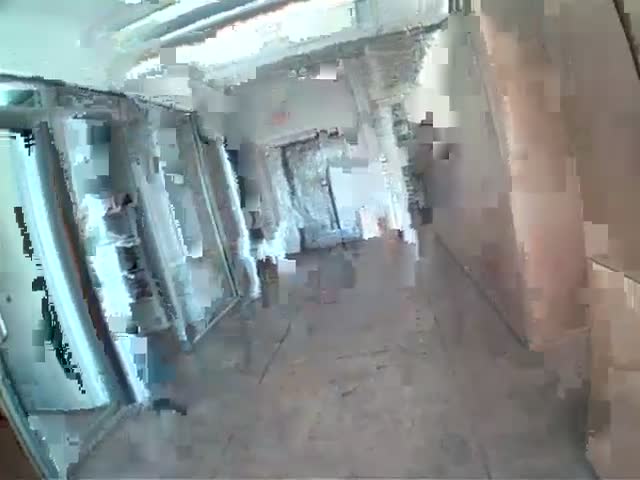
Find the location of a particular element. This screenshot has height=480, width=640. dark wood panel is located at coordinates (13, 459).